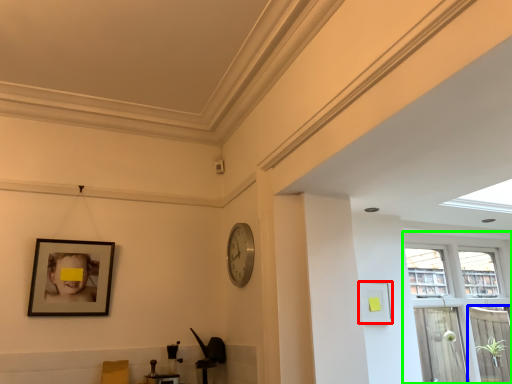
Question: Which is nearer to the picture frame (highlighted by a red box)? screen door (highlighted by a blue box) or window (highlighted by a green box).

Choices:
 (A) screen door
 (B) window

Answer: (B)